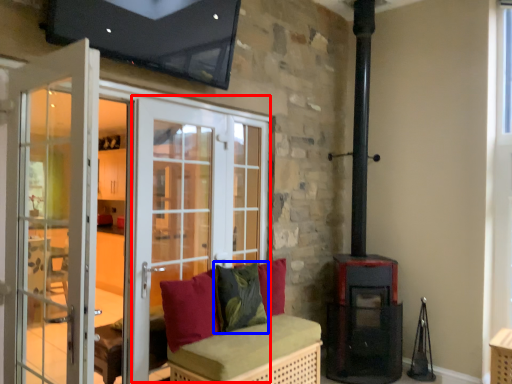
Question: Which point is further to the camera, screen door (highlighted by a red box) or pillow (highlighted by a blue box)?

Choices:
 (A) screen door
 (B) pillow

Answer: (B)